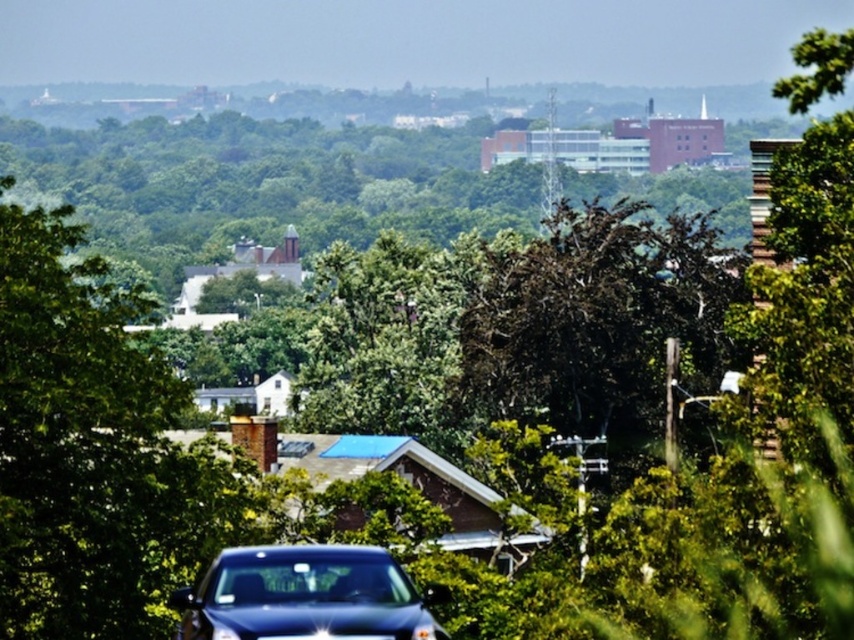
Question: Which of the following is the farthest from the observer?

Choices:
 (A) green leafy tree at center
 (B) glossy dark blue car at lower center

Answer: (A)

Question: In this image, where is green leafy tree at center located relative to glossy dark blue car at lower center?

Choices:
 (A) below
 (B) above

Answer: (B)

Question: In this image, where is green leafy tree at center located relative to glossy dark blue car at lower center?

Choices:
 (A) left
 (B) right

Answer: (A)

Question: Observing the image, what is the correct spatial positioning of green leafy tree at center in reference to glossy dark blue car at lower center?

Choices:
 (A) above
 (B) below

Answer: (A)